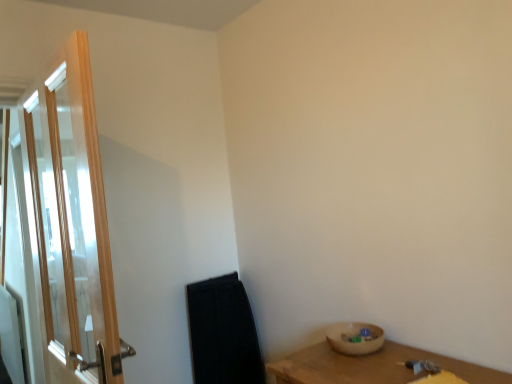
Question: From the image's perspective, is wooden bowl at lower right located beneath clear glass door at left?

Choices:
 (A) yes
 (B) no

Answer: (A)

Question: Considering the relative positions of wooden bowl at lower right and clear glass door at left in the image provided, is wooden bowl at lower right to the right of clear glass door at left from the viewer's perspective?

Choices:
 (A) no
 (B) yes

Answer: (B)

Question: Is wooden bowl at lower right thinner than clear glass door at left?

Choices:
 (A) yes
 (B) no

Answer: (B)

Question: From a real-world perspective, does wooden bowl at lower right stand above clear glass door at left?

Choices:
 (A) no
 (B) yes

Answer: (A)

Question: Does wooden bowl at lower right have a greater width compared to clear glass door at left?

Choices:
 (A) yes
 (B) no

Answer: (A)

Question: From the image's perspective, would you say wooden bowl at lower right is positioned over clear glass door at left?

Choices:
 (A) yes
 (B) no

Answer: (B)

Question: Is wooden bowl at lower right surrounded by clear glass door at left?

Choices:
 (A) yes
 (B) no

Answer: (B)

Question: Would you say clear glass door at left is outside wooden bowl at lower right?

Choices:
 (A) no
 (B) yes

Answer: (B)

Question: From the image's perspective, does clear glass door at left appear higher than wooden bowl at lower right?

Choices:
 (A) no
 (B) yes

Answer: (B)

Question: Does clear glass door at left appear on the left side of wooden bowl at lower right?

Choices:
 (A) yes
 (B) no

Answer: (A)

Question: Is clear glass door at left wider than wooden bowl at lower right?

Choices:
 (A) yes
 (B) no

Answer: (B)

Question: From a real-world perspective, is clear glass door at left below wooden bowl at lower right?

Choices:
 (A) no
 (B) yes

Answer: (A)

Question: From the image's perspective, is wooden bowl at lower right above or below clear glass door at left?

Choices:
 (A) below
 (B) above

Answer: (A)